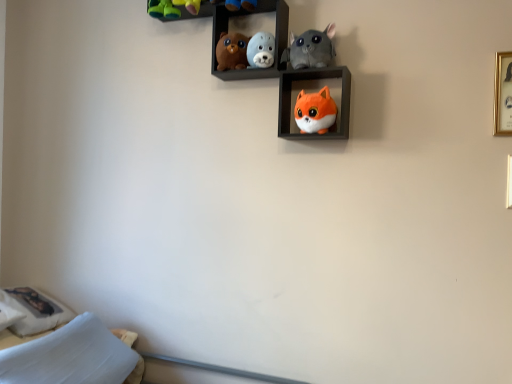
Question: Is matte brown plush bear at upper center, marked as the 4th toy in a right-to-left arrangement, outside of orange plush toy at center, the first shelf from the bottom?

Choices:
 (A) no
 (B) yes

Answer: (B)

Question: From a real-world perspective, is matte brown plush bear at upper center, marked as the 4th toy in a right-to-left arrangement, beneath orange plush toy at center, which ranks as the second shelf in left-to-right order?

Choices:
 (A) yes
 (B) no

Answer: (B)

Question: Can you confirm if matte brown plush bear at upper center, marked as the 4th toy in a right-to-left arrangement, is shorter than orange plush toy at center, the first shelf positioned from the right?

Choices:
 (A) yes
 (B) no

Answer: (A)

Question: Can you confirm if matte brown plush bear at upper center, marked as the 4th toy in a right-to-left arrangement, is smaller than orange plush toy at center, the first shelf positioned from the right?

Choices:
 (A) no
 (B) yes

Answer: (B)

Question: Does matte brown plush bear at upper center, positioned as the first toy in left-to-right order, have a larger size compared to orange plush toy at center, the first shelf positioned from the right?

Choices:
 (A) yes
 (B) no

Answer: (B)

Question: In the image, is gold metallic picture frame at upper right positioned in front of or behind velvety plush toys at upper center, which appears as the 2th shelf when ordered from the bottom?

Choices:
 (A) behind
 (B) front

Answer: (B)

Question: From a real-world perspective, is gold metallic picture frame at upper right physically located above or below velvety plush toys at upper center, the first shelf when ordered from left to right?

Choices:
 (A) below
 (B) above

Answer: (A)

Question: From the image's perspective, relative to velvety plush toys at upper center, marked as the 1th shelf in a top-to-bottom arrangement, is gold metallic picture frame at upper right above or below?

Choices:
 (A) below
 (B) above

Answer: (A)

Question: Which is correct: gold metallic picture frame at upper right is inside velvety plush toys at upper center, the first shelf when ordered from left to right, or outside of it?

Choices:
 (A) inside
 (B) outside

Answer: (B)

Question: From a real-world perspective, is orange plush toy at center, the first shelf positioned from the right, physically located above or below rubber duckies at upper center?

Choices:
 (A) below
 (B) above

Answer: (A)

Question: From the image's perspective, relative to rubber duckies at upper center, is orange plush toy at center, which ranks as the second shelf in left-to-right order, above or below?

Choices:
 (A) above
 (B) below

Answer: (B)

Question: Is orange plush toy at center, the first shelf positioned from the right, taller or shorter than rubber duckies at upper center?

Choices:
 (A) short
 (B) tall

Answer: (B)

Question: Is orange plush toy at center, the first shelf positioned from the right, wider or thinner than rubber duckies at upper center?

Choices:
 (A) thin
 (B) wide

Answer: (B)

Question: Based on their sizes in the image, would you say orange plush toy at center, the first shelf positioned from the right, is bigger or smaller than matte brown plush bear at upper center, positioned as the first toy in left-to-right order?

Choices:
 (A) big
 (B) small

Answer: (A)

Question: Considering the relative positions of orange plush toy at center, the first shelf positioned from the right, and matte brown plush bear at upper center, positioned as the first toy in left-to-right order, in the image provided, is orange plush toy at center, the first shelf positioned from the right, to the left or to the right of matte brown plush bear at upper center, positioned as the first toy in left-to-right order,?

Choices:
 (A) left
 (B) right

Answer: (B)